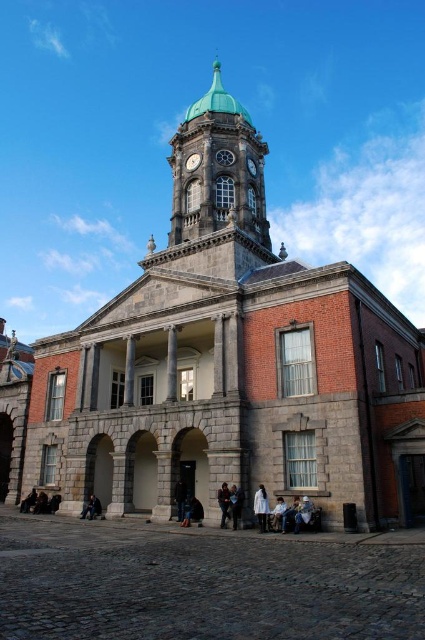
Is light brown leather jacket at center smaller than dark gray stone person at lower left?

Incorrect, light brown leather jacket at center is not smaller in size than dark gray stone person at lower left.

Consider the image. Can you confirm if light brown leather jacket at center is positioned below dark gray stone person at lower left?

Actually, light brown leather jacket at center is above dark gray stone person at lower left.

At what (x,y) coordinates should I click in order to perform the action: click on light brown leather jacket at center. Please return your answer as a coordinate pair (x, y). Looking at the image, I should click on pos(235,504).

Can you confirm if light brown leather jacket at lower center is smaller than dark gray stone person at lower left?

Incorrect, light brown leather jacket at lower center is not smaller in size than dark gray stone person at lower left.

Which is in front, point (285, 525) or point (20, 509)?

Point (285, 525) is more forward.

Who is more forward, (289,524) or (28,502)?

Point (289,524) is more forward.

The image size is (425, 640). In order to click on light brown leather jacket at lower center in this screenshot , I will do `click(289, 515)`.

Is red brick church at center wider than leather jacket at lower center?

Yes.

Does red brick church at center lie behind leather jacket at lower center?

No, it is not.

Which is in front, point (215, 244) or point (184, 502)?

Point (184, 502) is more forward.

Locate an element on the screen. red brick church at center is located at coordinates (224, 364).